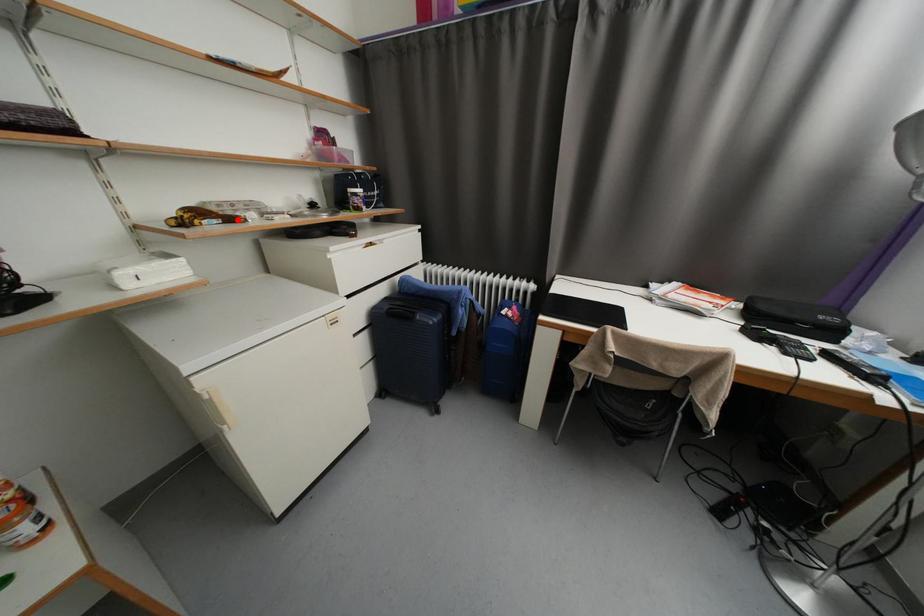
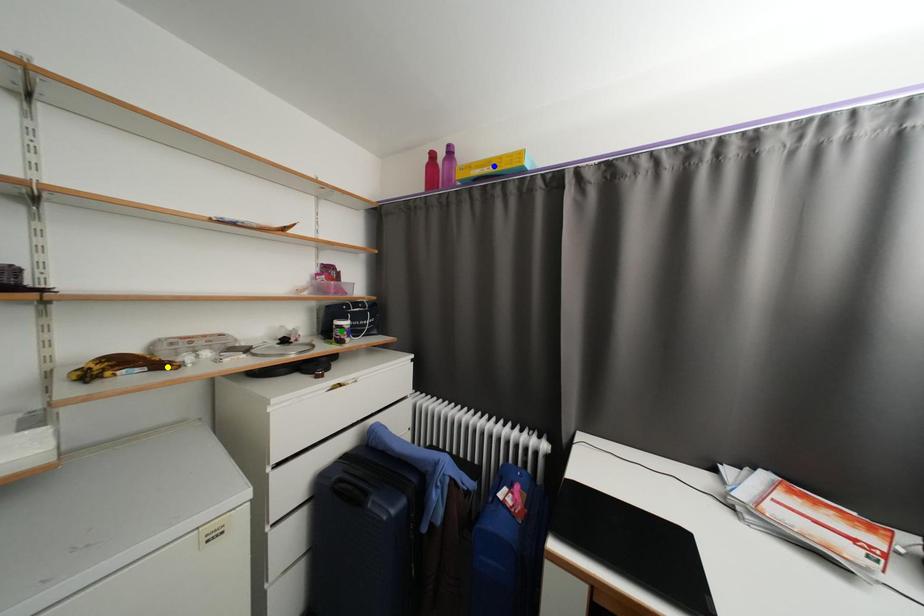
Question: I am providing you with two images of the same scene from different viewpoints. A red point is marked on the first image. You are given multiple points on the second image. In image 2, which mark is for the same physical point as the one in image 1?

Choices:
 (A) blue point
 (B) green point
 (C) yellow point

Answer: (C)